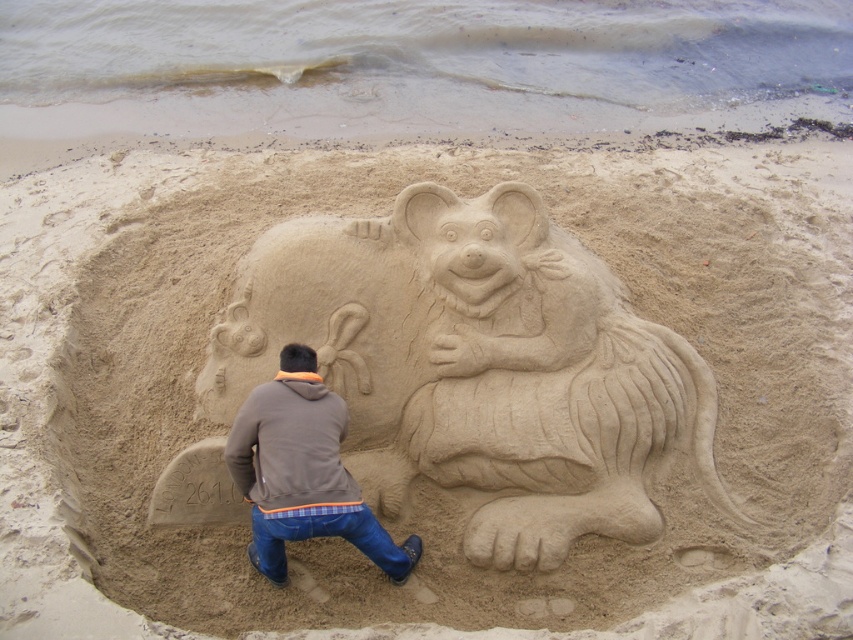
You are a fashion designer observing the image. You need to determine which clothing item is taller between the brown cotton hoodie at center and the brown fleece jacket at lower center. Which one is taller?

The brown cotton hoodie at center is taller than the brown fleece jacket at lower center according to the description.

You are a beachgoer who wants to take a photo of the smooth sand bear at center and the brown fleece jacket at lower center. Since you want both objects in focus, you need to know if they are within the same focal range. Are they close enough in height to be in focus at the same time?

The smooth sand bear at center is taller than the brown fleece jacket at lower center, but since the height difference is not specified, it is possible they could be within the same focal range depending on the camera settings. However, without exact measurements, it is hard to determine definitively.

You are a photographer standing at the edge of the beach, wanting to capture both the smooth sand bear at center and the brown cotton hoodie at center in a single frame. Based on their positions, which object should you focus on first to ensure both are in the frame?

The smooth sand bear at center is positioned on the right side of brown cotton hoodie at center, so you should focus on the brown cotton hoodie at center first to ensure both are in the frame.